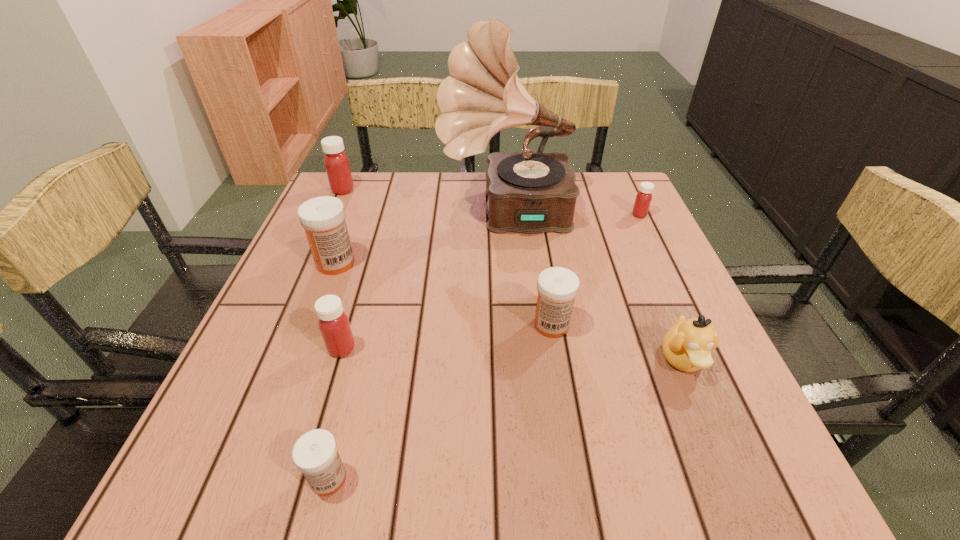
The width and height of the screenshot is (960, 540). I want to click on free location located 0.100m on the left of the rightmost white medicine, so click(482, 325).

Locate an element on the screen. The height and width of the screenshot is (540, 960). vacant space located on the left of the second red medicine from left to right is located at coordinates (296, 348).

At what (x,y) coordinates should I click in order to perform the action: click on vacant space situated on the face of the tan duckling. Please return your answer as a coordinate pair (x, y). This screenshot has width=960, height=540. Looking at the image, I should click on [x=736, y=487].

Image resolution: width=960 pixels, height=540 pixels. What are the coordinates of `free space located 0.250m on the left of the second farthest medicine` in the screenshot? It's located at (537, 215).

The width and height of the screenshot is (960, 540). Identify the location of vacant region located 0.090m on the back of the nearest white medicine. [347, 407].

Locate an element on the screen. This screenshot has width=960, height=540. record player at the far edge is located at coordinates (528, 192).

Find the location of a particular element. object that is at the near edge is located at coordinates (315, 454).

What are the coordinates of `duckling situated at the right edge` in the screenshot? It's located at (687, 345).

Identify the location of medicine that is at the right edge. (643, 199).

In order to click on object that is at the far left corner in this screenshot , I will do `click(336, 162)`.